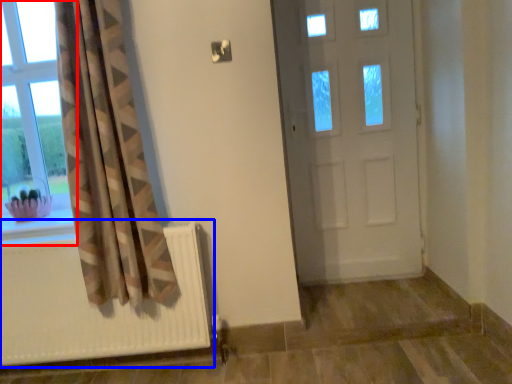
Question: Which of the following is the farthest to the observer, window (highlighted by a red box) or radiator (highlighted by a blue box)?

Choices:
 (A) window
 (B) radiator

Answer: (A)